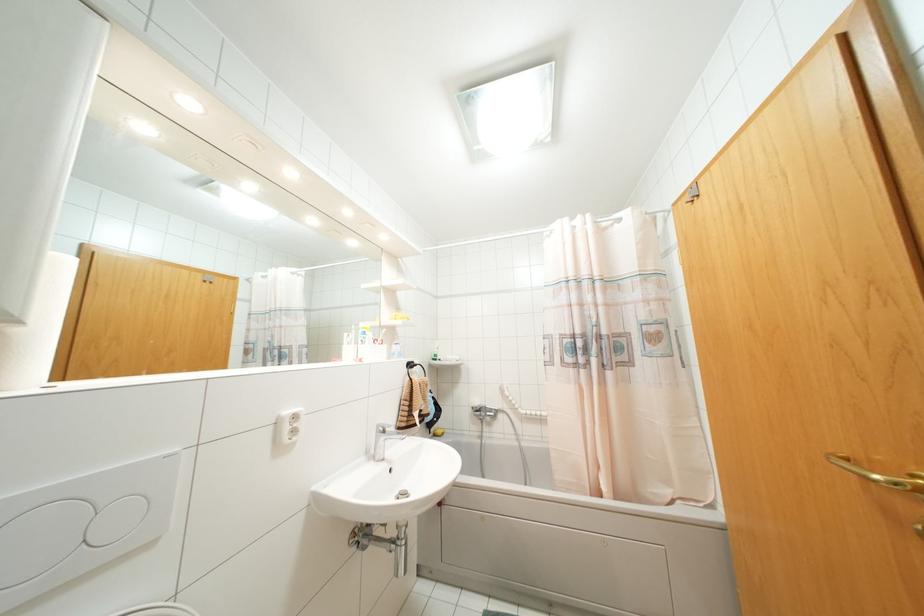
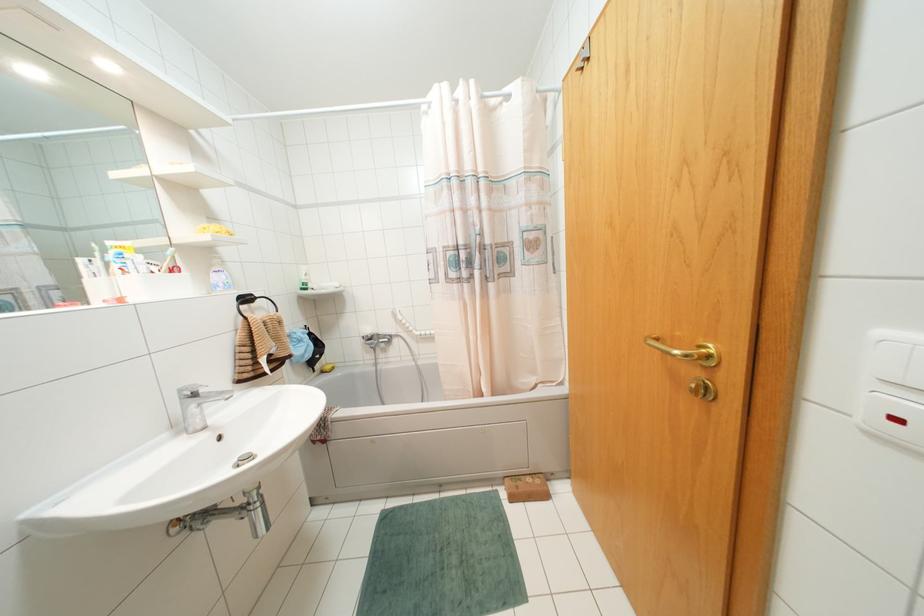
In the scene shown: Based on the continuous images, in which direction is the camera rotating?

The camera rotated toward right-down.